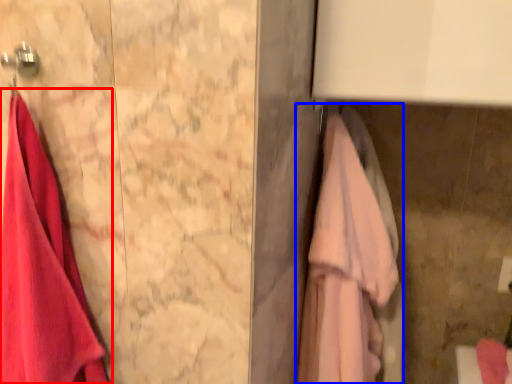
Question: Which of the following is the farthest to the observer, towel (highlighted by a red box) or towel (highlighted by a blue box)?

Choices:
 (A) towel
 (B) towel

Answer: (B)